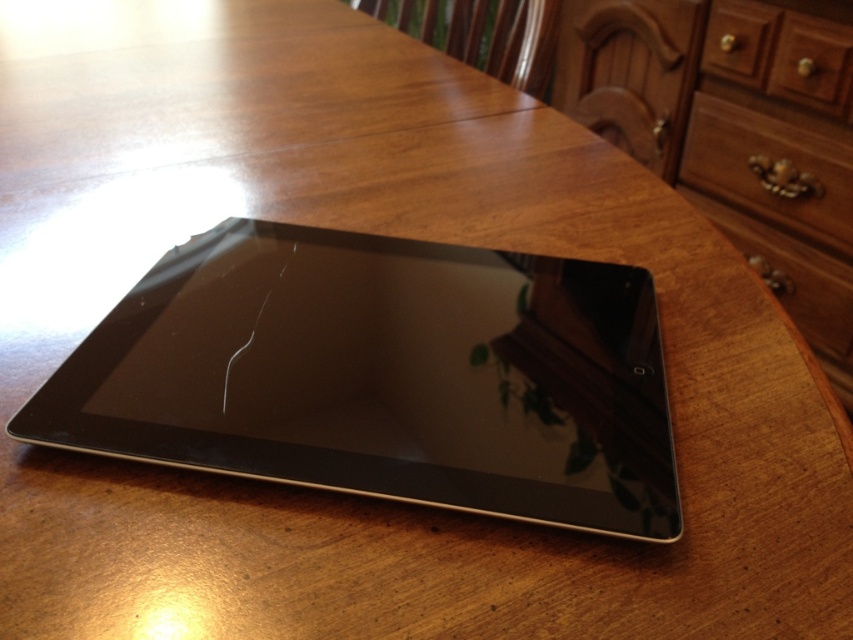
In the scene shown: You are organizing a small toy car that is 15 cm long. You see the brown wood dresser at upper right and the brown wood drawer at upper right. Which one has enough space to store the toy car?

The brown wood dresser at upper right is bigger than the brown wood drawer at upper right, so the brown wood dresser at upper right has enough space to store the toy car.

You are organizing items on a wooden table. You have a black glossy tablet at center and a wooden drawer at center. Which item is shorter?

The black glossy tablet at center is shorter than the wooden drawer at center.